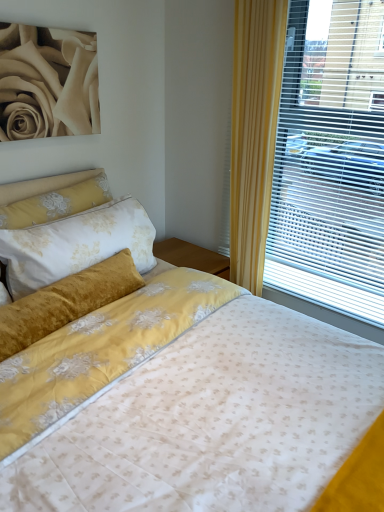
Question: Should I look upward or downward to see velvet yellow pillow at upper left?

Choices:
 (A) down
 (B) up

Answer: (B)

Question: Can you confirm if velvet yellow pillow at upper left is shorter than matte cream rose at upper left?

Choices:
 (A) yes
 (B) no

Answer: (A)

Question: From the image's perspective, is velvet yellow pillow at upper left on matte cream rose at upper left?

Choices:
 (A) no
 (B) yes

Answer: (A)

Question: Considering the relative positions of velvet yellow pillow at upper left and matte cream rose at upper left in the image provided, is velvet yellow pillow at upper left to the left of matte cream rose at upper left from the viewer's perspective?

Choices:
 (A) no
 (B) yes

Answer: (A)

Question: Does velvet yellow pillow at upper left have a greater width compared to matte cream rose at upper left?

Choices:
 (A) yes
 (B) no

Answer: (A)

Question: Is velvet yellow pillow at upper left facing away from matte cream rose at upper left?

Choices:
 (A) no
 (B) yes

Answer: (A)

Question: From a real-world perspective, is velvet yellow pillow at upper left below matte cream rose at upper left?

Choices:
 (A) yes
 (B) no

Answer: (A)

Question: Is matte cream rose at upper left facing away from velvet yellow pillow at upper left?

Choices:
 (A) yes
 (B) no

Answer: (B)

Question: From a real-world perspective, is matte cream rose at upper left on top of velvet yellow pillow at upper left?

Choices:
 (A) yes
 (B) no

Answer: (A)

Question: Does matte cream rose at upper left have a larger size compared to velvet yellow pillow at upper left?

Choices:
 (A) yes
 (B) no

Answer: (B)

Question: Considering the relative sizes of matte cream rose at upper left and velvet yellow pillow at upper left in the image provided, is matte cream rose at upper left smaller than velvet yellow pillow at upper left?

Choices:
 (A) yes
 (B) no

Answer: (A)

Question: Could you tell me if matte cream rose at upper left is facing velvet yellow pillow at upper left?

Choices:
 (A) no
 (B) yes

Answer: (A)

Question: From a real-world perspective, is matte cream rose at upper left positioned under velvet yellow pillow at upper left based on gravity?

Choices:
 (A) no
 (B) yes

Answer: (A)

Question: Would you say matte cream rose at upper left is outside matte blinds at right?

Choices:
 (A) yes
 (B) no

Answer: (A)